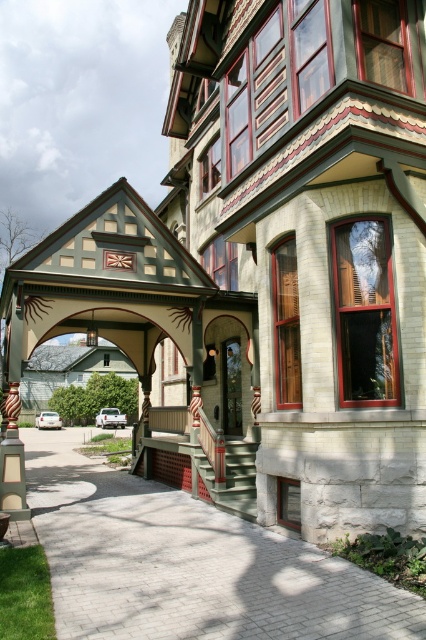
You are standing in front of the Victorian house and want to take a photo. You notice two points marked on the image. Which point is closer to your camera lens? Please choose between the point at coordinates point (408, 604) and point (250, 451).

The point at coordinates point (408, 604) is closer to the camera lens than the point at coordinates point (250, 451).

You are a delivery person trying to park your van on the gray brick driveway at lower left. The van is 2 meters wide. The green painted wood porch at lower center is in front of the driveway. Can the van fit on the driveway without overlapping the porch?

The gray brick driveway at lower left is wider than the green painted wood porch at lower center. Since the driveway is wider, the van which is 2 meters wide can fit on the driveway without overlapping the porch.

You are standing at the front entrance of the Victorian house and want to park your car. The gray brick driveway at lower left is represented by point (190, 564). Where should you drive to park your car?

The gray brick driveway at lower left is represented by point (190, 564), so you should drive towards that point to park your car.